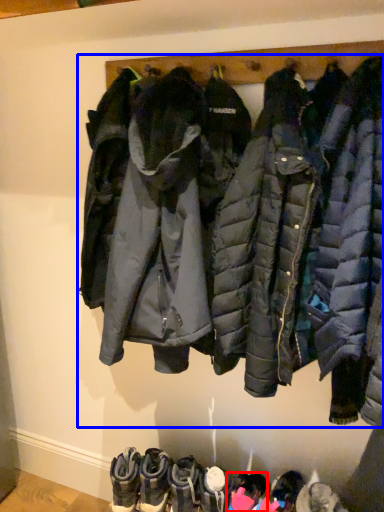
Question: Which object appears closest to the camera in this image, footwear (highlighted by a red box) or jacket (highlighted by a blue box)?

Choices:
 (A) footwear
 (B) jacket

Answer: (B)